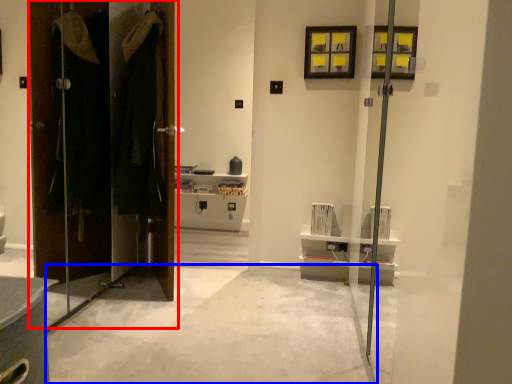
Question: Among these objects, which one is nearest to the camera, door (highlighted by a red box) or concrete (highlighted by a blue box)?

Choices:
 (A) door
 (B) concrete

Answer: (B)